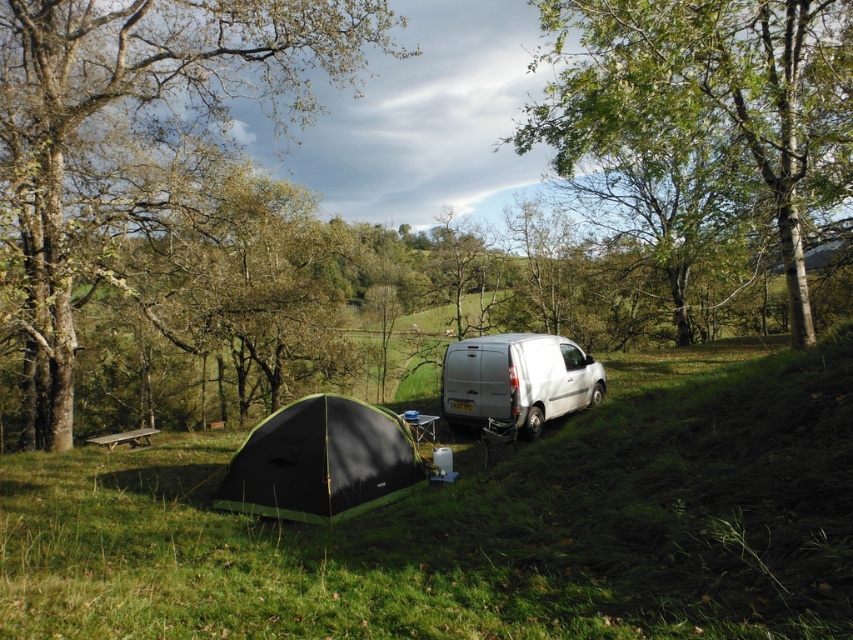
Question: Which point is closer to the camera?

Choices:
 (A) brown rough tree at left
 (B) green grassy at lower left
 (C) brown wooden picnic table at lower left

Answer: (B)

Question: Can you confirm if green grassy at lower left is positioned above brown wooden picnic table at lower left?

Choices:
 (A) yes
 (B) no

Answer: (A)

Question: Is black fabric tent at lower left to the right of white matte van at center from the viewer's perspective?

Choices:
 (A) yes
 (B) no

Answer: (B)

Question: Which point is farther to the camera?

Choices:
 (A) (380, 477)
 (B) (241, 278)
 (C) (790, 49)

Answer: (B)

Question: Estimate the real-world distances between objects in this image. Which object is closer to the brown rough tree at left?

Choices:
 (A) green grassy at lower left
 (B) brown wooden picnic table at lower left
 (C) green leafy tree at upper center
 (D) white matte van at center

Answer: (B)

Question: Considering the relative positions of brown rough tree at left and black fabric tent at lower left in the image provided, where is brown rough tree at left located with respect to black fabric tent at lower left?

Choices:
 (A) left
 (B) right

Answer: (A)